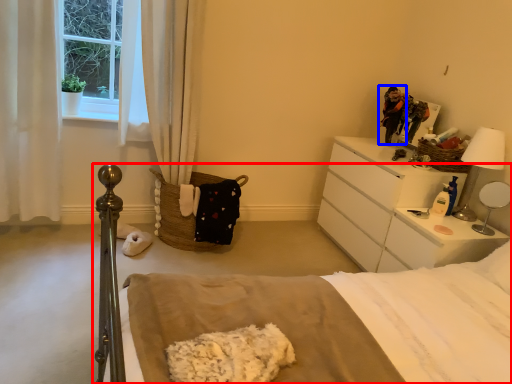
Question: Which of the following is the farthest to the observer, bed (highlighted by a red box) or person (highlighted by a blue box)?

Choices:
 (A) bed
 (B) person

Answer: (B)